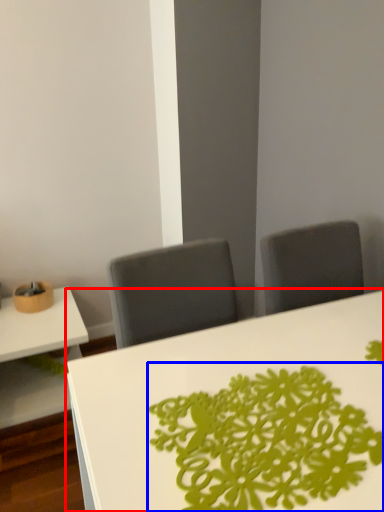
Question: Which object appears farthest to the camera in this image, table (highlighted by a red box) or floral arrangement (highlighted by a blue box)?

Choices:
 (A) table
 (B) floral arrangement

Answer: (B)